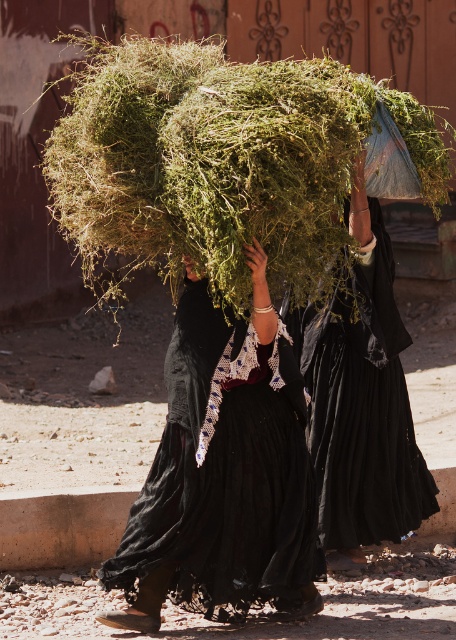
Is green grassy hay at center above black matte dress at center?

Indeed, green grassy hay at center is positioned over black matte dress at center.

From the picture: Does green grassy hay at center have a greater width compared to black matte dress at center?

Correct, the width of green grassy hay at center exceeds that of black matte dress at center.

I want to click on green grassy hay at center, so click(219, 163).

Is point (200, 474) closer to viewer compared to point (326, 307)?

Yes, it is.

What do you see at coordinates (223, 472) in the screenshot? The height and width of the screenshot is (640, 456). I see `black fabric dress at center` at bounding box center [223, 472].

Find the location of a particular element. black fabric dress at center is located at coordinates (223, 472).

Which of these two, green grassy hay at center or black fabric dress at center, stands shorter?

Standing shorter between the two is green grassy hay at center.

Is point (244, 292) positioned behind point (134, 605)?

No.

Does point (164, 61) come farther from viewer compared to point (213, 476)?

That is False.

Locate an element on the screen. green grassy hay at center is located at coordinates (219, 163).